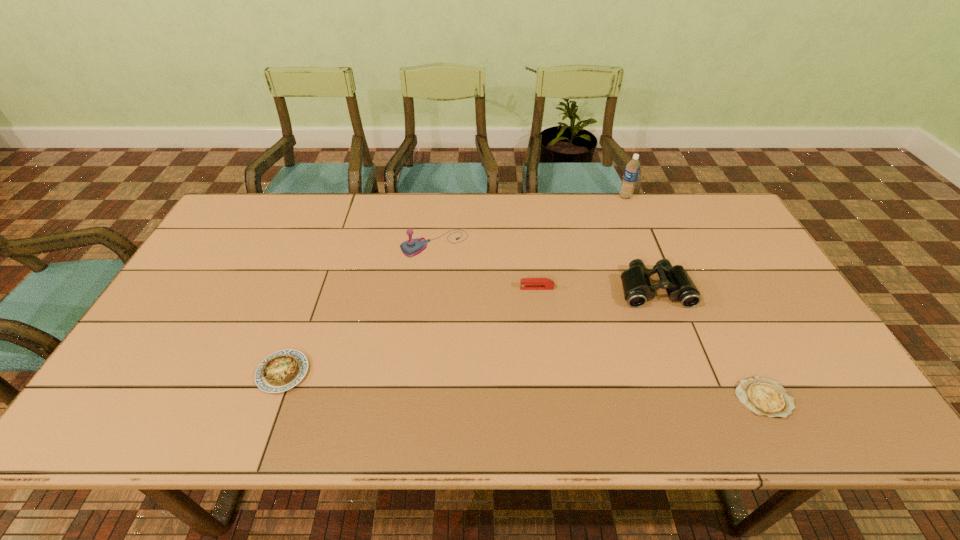
This screenshot has height=540, width=960. What are the coordinates of `the shorter quiche` in the screenshot? It's located at (765, 397).

Find the location of `vacant space situated 0.070m on the right of the farthest object`. vacant space situated 0.070m on the right of the farthest object is located at coordinates (652, 197).

Locate an element on the screen. Image resolution: width=960 pixels, height=540 pixels. vacant space situated 0.130m on the front of the fifth object from right to left is located at coordinates (429, 291).

I want to click on free spot located on the front-facing side of the binoculars, so [677, 348].

This screenshot has width=960, height=540. I want to click on vacant space located on the front-facing side of the third shortest object, so click(x=378, y=288).

You are a GUI agent. You are given a task and a screenshot of the screen. Output one action in this format:
    pyautogui.click(x=<x>, y=<y>)
    Task: Click on the vacant position located 0.090m on the front-facing side of the third shortest object
    The height and width of the screenshot is (540, 960).
    Given the screenshot: What is the action you would take?
    pyautogui.click(x=488, y=288)

Locate an element on the screen. The height and width of the screenshot is (540, 960). vacant space located 0.110m on the front-facing side of the third shortest object is located at coordinates tap(481, 288).

Locate an element on the screen. The image size is (960, 540). free location located on the back of the leftmost object is located at coordinates (302, 320).

This screenshot has width=960, height=540. I want to click on vacant space situated on the left of the shortest object, so click(x=578, y=398).

You are a GUI agent. You are given a task and a screenshot of the screen. Output one action in this format:
    pyautogui.click(x=<x>, y=<y>)
    Task: Click on the water bottle situated at the far edge
    The height and width of the screenshot is (540, 960).
    Given the screenshot: What is the action you would take?
    pyautogui.click(x=632, y=169)